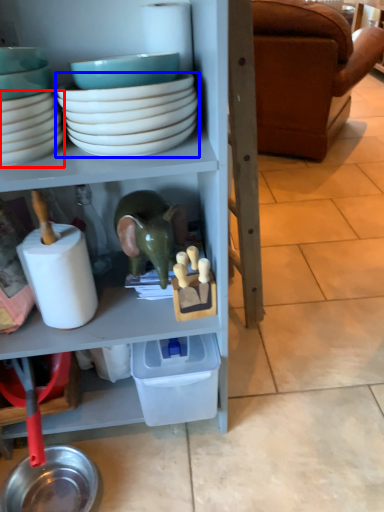
Question: Which object is closer to the camera taking this photo, bowl (highlighted by a red box) or bowl (highlighted by a blue box)?

Choices:
 (A) bowl
 (B) bowl

Answer: (B)